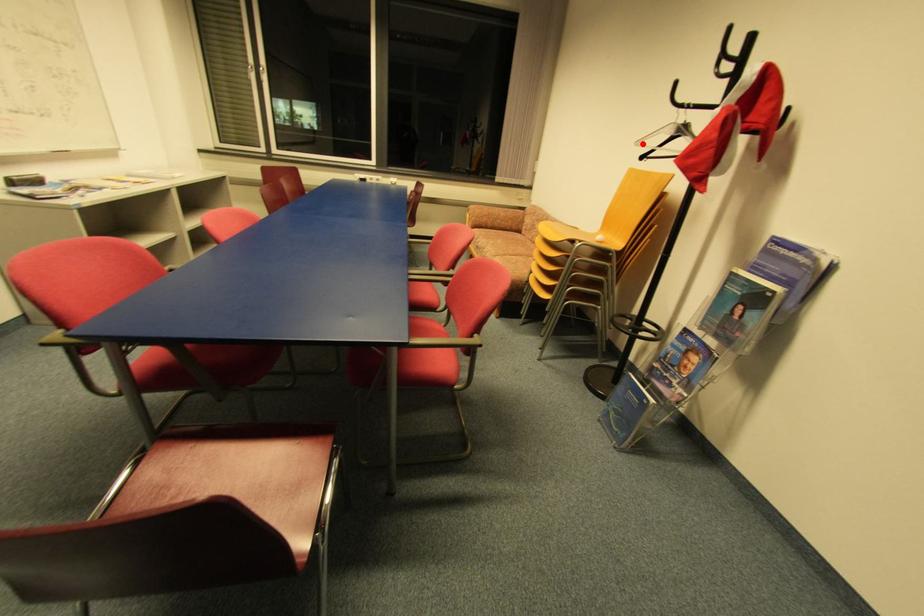
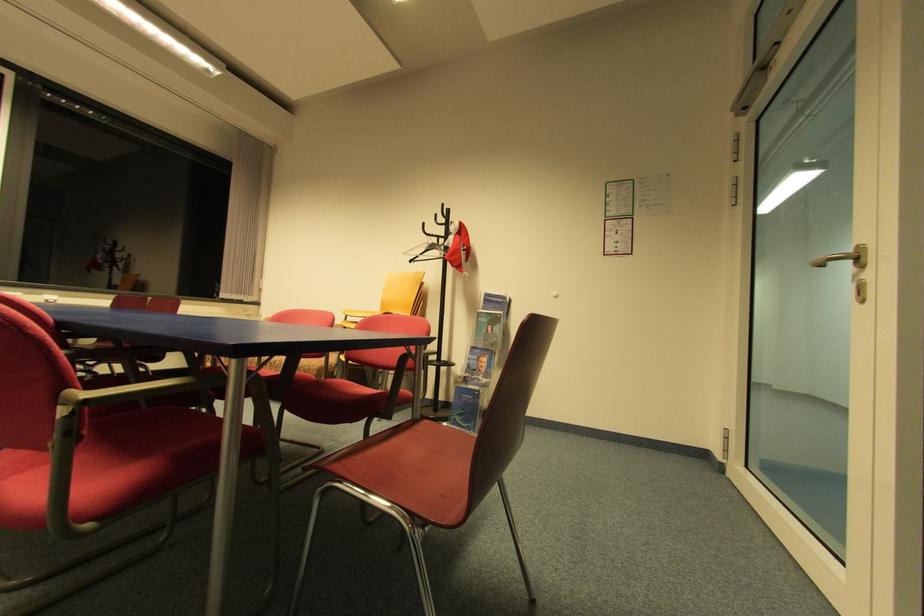
Find the pixel in the second image that matches the highlighted location in the first image.

(408, 254)